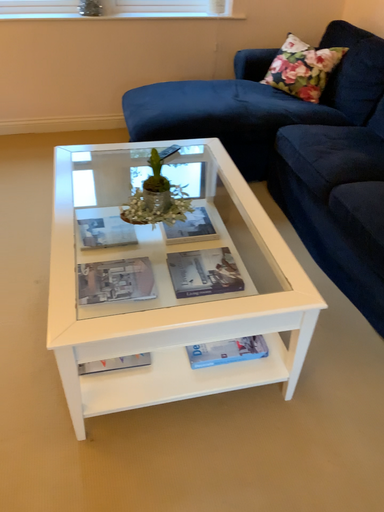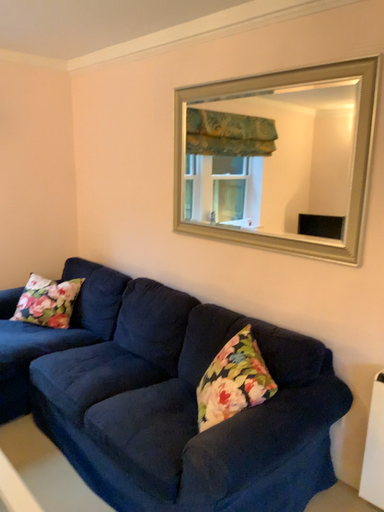
Question: How did the camera likely rotate when shooting the video?

Choices:
 (A) rotated upward
 (B) rotated downward

Answer: (A)